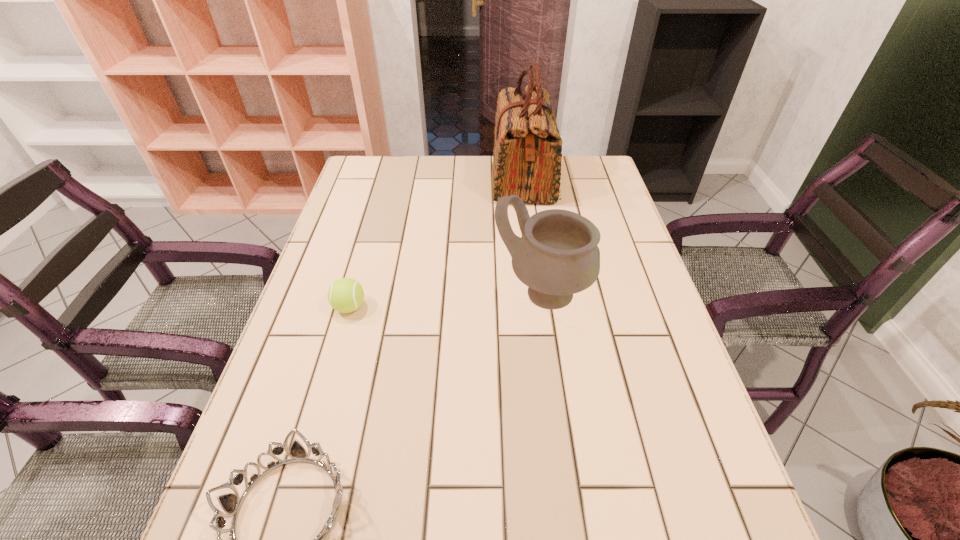
This screenshot has width=960, height=540. I want to click on object located in the left edge section of the desktop, so click(345, 295).

I want to click on object that is at the right edge, so click(557, 256).

Where is `blank space at the near edge of the desktop`? blank space at the near edge of the desktop is located at coordinates (439, 531).

This screenshot has height=540, width=960. In order to click on vacant space at the left edge of the desktop in this screenshot , I will do tap(387, 194).

In order to click on free space at the right edge in this screenshot , I will do `click(641, 294)`.

Where is `vacant region at the far right corner`? This screenshot has height=540, width=960. vacant region at the far right corner is located at coordinates (583, 174).

This screenshot has width=960, height=540. In order to click on free space between the tennis ball and the shopping bag in this screenshot , I will do `click(437, 243)`.

Find the location of a particular element. The image size is (960, 540). the third closest object to the tiara is located at coordinates (527, 156).

Locate an element on the screen. The image size is (960, 540). the third closest object to the tennis ball is located at coordinates click(x=527, y=156).

The image size is (960, 540). I want to click on blank area in the image that satisfies the following two spatial constraints: 1. on the open handle side of the pottery; 2. on the left side of the shopping bag, so click(x=539, y=293).